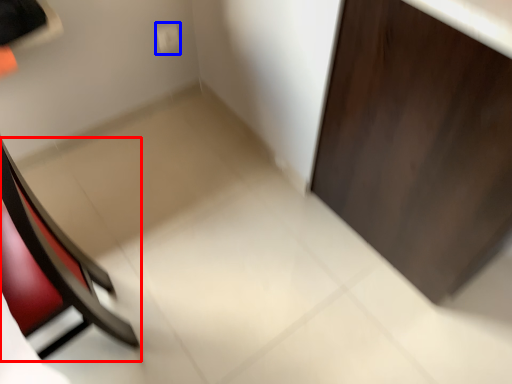
Question: Which object appears farthest to the camera in this image, chair (highlighted by a red box) or electric outlet (highlighted by a blue box)?

Choices:
 (A) chair
 (B) electric outlet

Answer: (B)